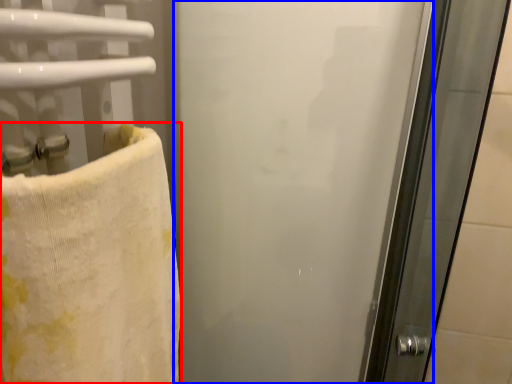
Question: Among these objects, which one is farthest to the camera, towel (highlighted by a red box) or screen door (highlighted by a blue box)?

Choices:
 (A) towel
 (B) screen door

Answer: (B)